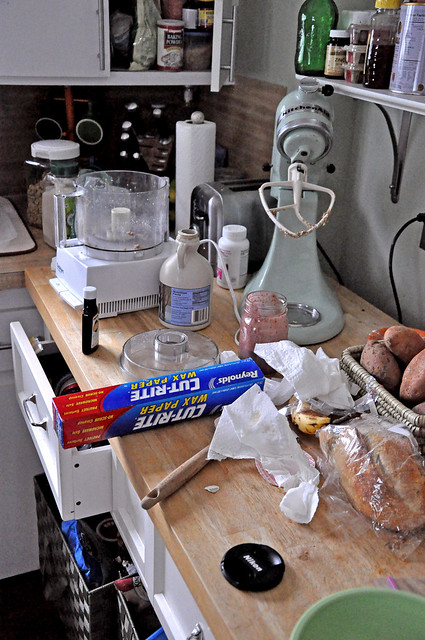
Where is `handle`? Image resolution: width=425 pixels, height=640 pixels. handle is located at coordinates (103, 48), (29, 417), (235, 61), (58, 219), (181, 253).